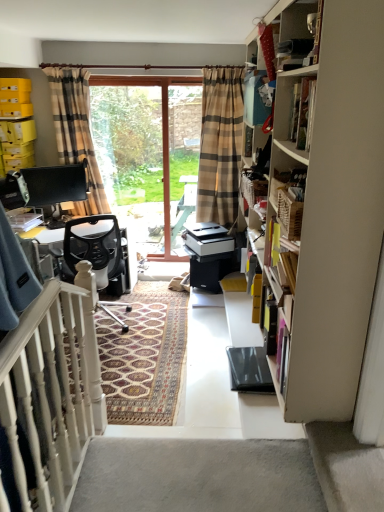
Question: Considering the relative positions of white carpet at lower right and black mesh office chair at center in the image provided, is white carpet at lower right to the left of black mesh office chair at center from the viewer's perspective?

Choices:
 (A) no
 (B) yes

Answer: (A)

Question: From a real-world perspective, is white carpet at lower right positioned over black mesh office chair at center based on gravity?

Choices:
 (A) yes
 (B) no

Answer: (A)

Question: Would you say white carpet at lower right is a long distance from black mesh office chair at center?

Choices:
 (A) no
 (B) yes

Answer: (B)

Question: From the image's perspective, is white carpet at lower right above black mesh office chair at center?

Choices:
 (A) no
 (B) yes

Answer: (A)

Question: Does white carpet at lower right have a lesser width compared to black mesh office chair at center?

Choices:
 (A) no
 (B) yes

Answer: (B)

Question: Looking at the image, does white carpet at lower right seem bigger or smaller compared to plaid fabric curtain at left?

Choices:
 (A) small
 (B) big

Answer: (A)

Question: From their relative heights in the image, would you say white carpet at lower right is taller or shorter than plaid fabric curtain at left?

Choices:
 (A) short
 (B) tall

Answer: (A)

Question: From the image's perspective, is white carpet at lower right positioned above or below plaid fabric curtain at left?

Choices:
 (A) above
 (B) below

Answer: (B)

Question: Considering the positions of white carpet at lower right and plaid fabric curtain at left in the image, is white carpet at lower right wider or thinner than plaid fabric curtain at left?

Choices:
 (A) wide
 (B) thin

Answer: (A)

Question: From the image's perspective, is plaid fabric curtain at left positioned above or below white wooden balustrade at lower left?

Choices:
 (A) above
 (B) below

Answer: (A)

Question: Considering their positions, is plaid fabric curtain at left located in front of or behind white wooden balustrade at lower left?

Choices:
 (A) behind
 (B) front

Answer: (A)

Question: From a real-world perspective, relative to white wooden balustrade at lower left, is plaid fabric curtain at left vertically above or below?

Choices:
 (A) below
 (B) above

Answer: (B)

Question: Based on their positions, is plaid fabric curtain at left located to the left or right of white wooden balustrade at lower left?

Choices:
 (A) right
 (B) left

Answer: (B)

Question: In the image, is clear glass screen door at center positioned in front of or behind wooden cabinet at upper right?

Choices:
 (A) behind
 (B) front

Answer: (A)

Question: From a real-world perspective, is clear glass screen door at center positioned above or below wooden cabinet at upper right?

Choices:
 (A) above
 (B) below

Answer: (B)